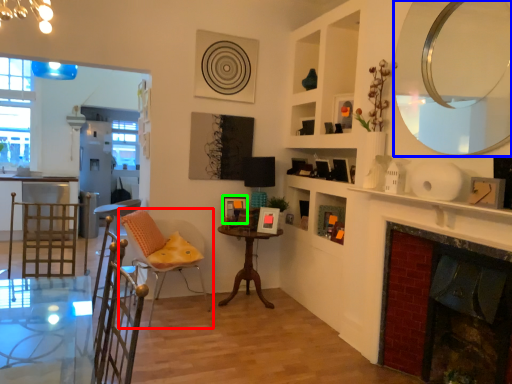
Question: Considering the real-world distances, which object is closest to chair (highlighted by a red box)? mirror (highlighted by a blue box) or picture frame (highlighted by a green box).

Choices:
 (A) mirror
 (B) picture frame

Answer: (B)